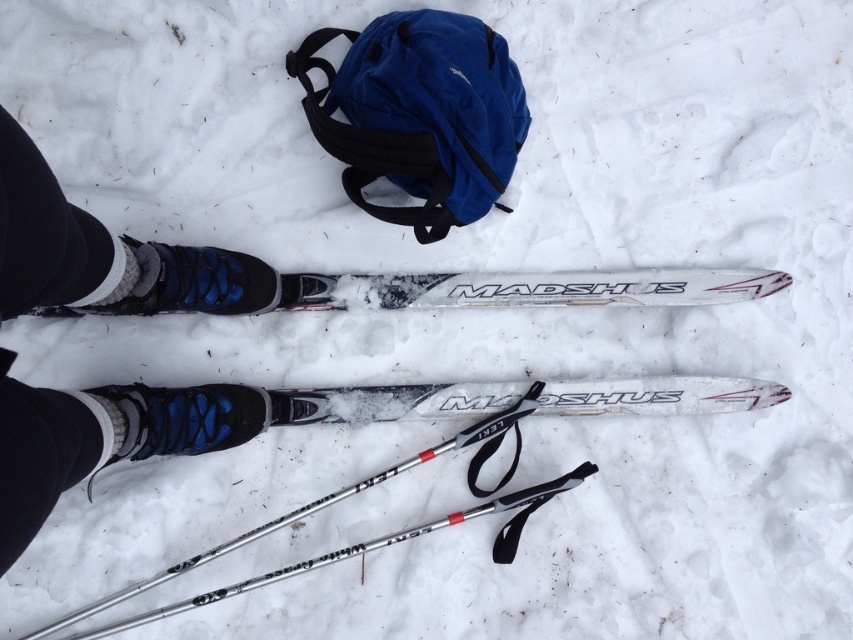
Question: Estimate the real-world distances between objects in this image. Which object is closer to the white matte ski at lower center?

Choices:
 (A) blue synthetic ski boot at lower left
 (B) silver metallic ski pole at lower center

Answer: (B)

Question: Where is blue synthetic ski boot at lower left located in relation to white matte madshus ski at center in the image?

Choices:
 (A) right
 (B) left

Answer: (B)

Question: From the image, what is the correct spatial relationship of blue synthetic ski boot at lower left in relation to white matte ski at lower center?

Choices:
 (A) above
 (B) below

Answer: (B)

Question: Among these objects, which one is nearest to the camera?

Choices:
 (A) white matte ski at lower center
 (B) white matte madshus ski at center
 (C) blue synthetic ski boot at lower left
 (D) silver metallic ski pole at lower center

Answer: (C)

Question: Does blue synthetic ski boot at lower left appear on the left side of white matte ski at lower center?

Choices:
 (A) no
 (B) yes

Answer: (B)

Question: Which of these objects is positioned closest to the white matte madshus ski at center?

Choices:
 (A) blue synthetic ski boot at lower left
 (B) white matte ski at lower center

Answer: (B)